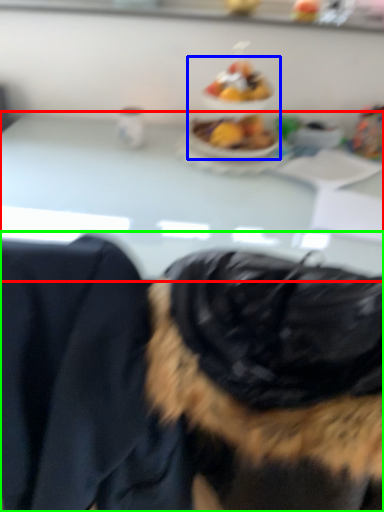
Question: Based on their relative distances, which object is nearer to table (highlighted by a red box)? Choose from food (highlighted by a blue box) and dog (highlighted by a green box).

Choices:
 (A) food
 (B) dog

Answer: (A)